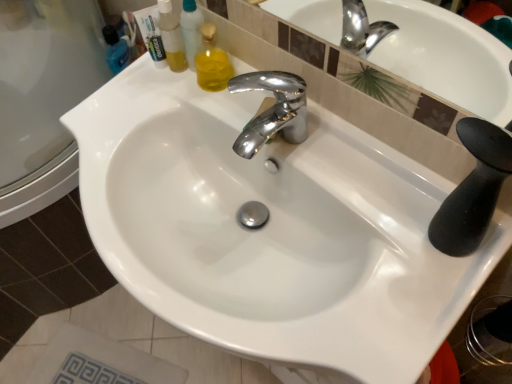
In order to click on chrome metallic faucet at center in this screenshot , I will do `click(272, 110)`.

This screenshot has width=512, height=384. What do you see at coordinates (272, 110) in the screenshot?
I see `chrome metallic faucet at center` at bounding box center [272, 110].

What do you see at coordinates (170, 37) in the screenshot?
I see `translucent plastic bottle at upper left` at bounding box center [170, 37].

This screenshot has height=384, width=512. I want to click on translucent plastic bottle at upper left, so click(170, 37).

At what (x,y) coordinates should I click in order to perform the action: click on chrome metallic faucet at center. Please return your answer as a coordinate pair (x, y). Looking at the image, I should click on (272, 110).

Considering the positions of objects chrome metallic faucet at center and translucent plastic bottle at upper left in the image provided, who is more to the right, chrome metallic faucet at center or translucent plastic bottle at upper left?

chrome metallic faucet at center.

Which object is closer to the camera, chrome metallic faucet at center or translucent plastic bottle at upper left?

chrome metallic faucet at center is more forward.

Which is behind, point (282, 86) or point (178, 28)?

The point (178, 28) is behind.

From the image's perspective, which one is positioned lower, chrome metallic faucet at center or translucent plastic bottle at upper left?

chrome metallic faucet at center is shown below in the image.

From a real-world perspective, is chrome metallic faucet at center below translucent plastic bottle at upper left?

Indeed, from a real-world perspective, chrome metallic faucet at center is positioned beneath translucent plastic bottle at upper left.

Is chrome metallic faucet at center wider or thinner than translucent plastic bottle at upper left?

Considering their sizes, chrome metallic faucet at center looks broader than translucent plastic bottle at upper left.

In terms of height, does chrome metallic faucet at center look taller or shorter compared to translucent plastic bottle at upper left?

Clearly, chrome metallic faucet at center is shorter compared to translucent plastic bottle at upper left.

Who is bigger, chrome metallic faucet at center or translucent plastic bottle at upper left?

translucent plastic bottle at upper left is bigger.

Is translucent plastic bottle at upper left inside chrome metallic faucet at center?

No, chrome metallic faucet at center does not contain translucent plastic bottle at upper left.

Would you consider chrome metallic faucet at center to be distant from translucent plastic bottle at upper left?

No, chrome metallic faucet at center is not far from translucent plastic bottle at upper left.

Could you tell me if chrome metallic faucet at center is facing translucent plastic bottle at upper left?

No, chrome metallic faucet at center is not turned towards translucent plastic bottle at upper left.

How many degrees apart are the facing directions of chrome metallic faucet at center and translucent plastic bottle at upper left?

The angle between the facing direction of chrome metallic faucet at center and the facing direction of translucent plastic bottle at upper left is 0.000199 degrees.

Measure the distance between chrome metallic faucet at center and translucent plastic bottle at upper left.

10.30 inches.

Locate an element on the screen. The height and width of the screenshot is (384, 512). cleaning product above the chrome metallic faucet at center (from the image's perspective) is located at coordinates (170, 37).

Looking at this image, can you confirm if translucent plastic bottle at upper left is positioned to the right of chrome metallic faucet at center?

No, translucent plastic bottle at upper left is not to the right of chrome metallic faucet at center.

In the image, is translucent plastic bottle at upper left positioned in front of or behind chrome metallic faucet at center?

translucent plastic bottle at upper left is positioned farther from the viewer than chrome metallic faucet at center.

Does point (165, 7) come farther from viewer compared to point (281, 124)?

That is True.

From the image's perspective, which one is positioned higher, translucent plastic bottle at upper left or chrome metallic faucet at center?

translucent plastic bottle at upper left.

Looking at this image, from a real-world perspective, which is physically below, translucent plastic bottle at upper left or chrome metallic faucet at center?

From a 3D spatial view, chrome metallic faucet at center is below.

Can you confirm if translucent plastic bottle at upper left is thinner than chrome metallic faucet at center?

Yes.

Between translucent plastic bottle at upper left and chrome metallic faucet at center, which one has more height?

Standing taller between the two is translucent plastic bottle at upper left.

Is translucent plastic bottle at upper left smaller than chrome metallic faucet at center?

Incorrect, translucent plastic bottle at upper left is not smaller in size than chrome metallic faucet at center.

Can we say translucent plastic bottle at upper left lies outside chrome metallic faucet at center?

translucent plastic bottle at upper left lies outside chrome metallic faucet at center's area.

Is translucent plastic bottle at upper left far from chrome metallic faucet at center?

No.

Is translucent plastic bottle at upper left turned away from chrome metallic faucet at center?

No, translucent plastic bottle at upper left's orientation is not away from chrome metallic faucet at center.

In order to click on tap located on the right of translucent plastic bottle at upper left in this screenshot , I will do `click(272, 110)`.

Where is `cleaning product that appears behind the chrome metallic faucet at center`? cleaning product that appears behind the chrome metallic faucet at center is located at coordinates (170, 37).

Locate an element on the screen. tap to the right of translucent plastic bottle at upper left is located at coordinates (272, 110).